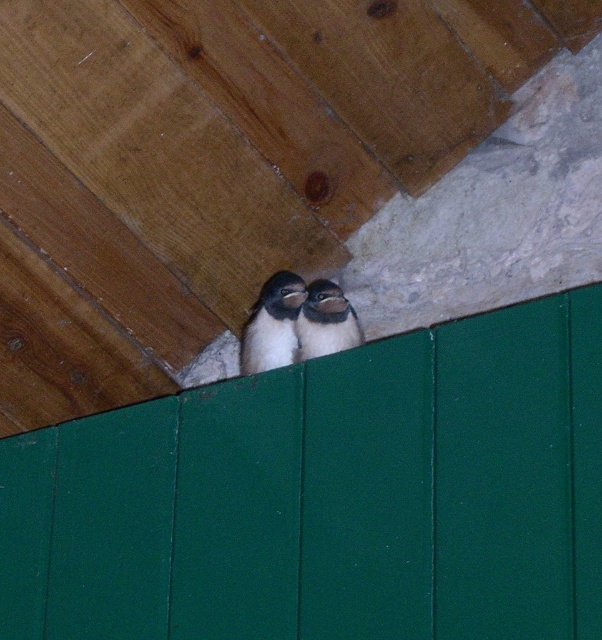
You are a zookeeper who needs to clean the wooden panels below the penguins. The white downy penguin at center and white matte penguin at center are perched on the stone wall. Which penguin is closer to the green wooden panels you need to clean?

The white downy penguin at center is closer to the green wooden panels because it is located below the white matte penguin at center, placing it nearer to the lower section where the panels are located.

You are a birdhouse builder who wants to place two nesting boxes for the birds. The birds are currently perched at point (281, 330). If each nesting box requires 2 meters of space, will the two nesting boxes fit side by side at that location?

The birds are 1.93 meters apart, so the two nesting boxes requiring 2 meters each would not fit side by side at that location since the distance between them is less than the required space.

You are a birdwatcher trying to determine the distance between two points in the image. You see the point at coordinates point (284, 273) and the point at coordinates point (324, 307). Which point is closer to you?

Point point (284, 273) is further to the viewer than point point (324, 307), so the point at coordinates point (324, 307) is closer to you.